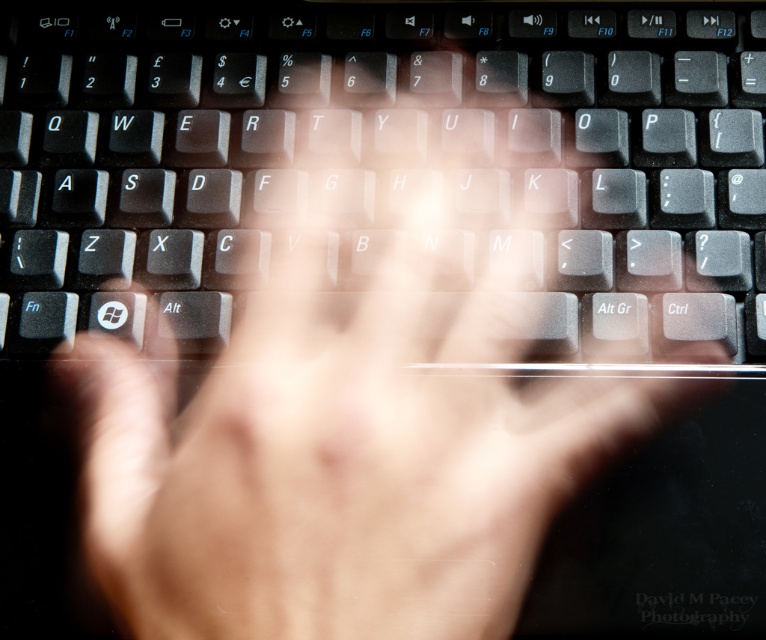
You are a photographer trying to capture a closeup of hands typing. The scene has a black matte keyboard at center and translucent skin at center. Based on their positions, which object is closer to the camera?

The black matte keyboard at center is located above the translucent skin at center, so it is closer to the camera.

You are a photographer trying to capture a closeup of the black matte keyboard at center. The camera is currently focused on the point at coordinates point (378,150). Is the camera focused on the keyboard?

The point (378,150) marks the black matte keyboard at center, so yes, the camera is focused on the black matte keyboard at center.